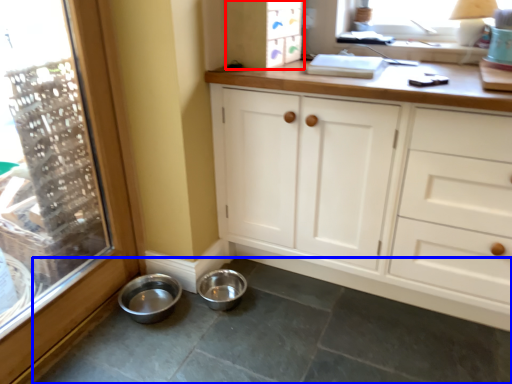
Question: Which object appears farthest to the camera in this image, cabinetry (highlighted by a red box) or concrete (highlighted by a blue box)?

Choices:
 (A) cabinetry
 (B) concrete

Answer: (A)